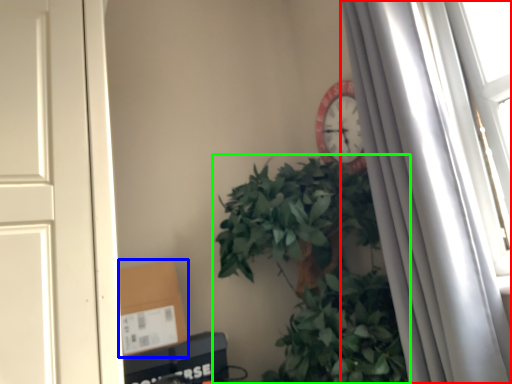
Question: Estimate the real-world distances between objects in this image. Which object is closer to curtain (highlighted by a red box), cardboard box (highlighted by a blue box) or houseplant (highlighted by a green box)?

Choices:
 (A) cardboard box
 (B) houseplant

Answer: (B)